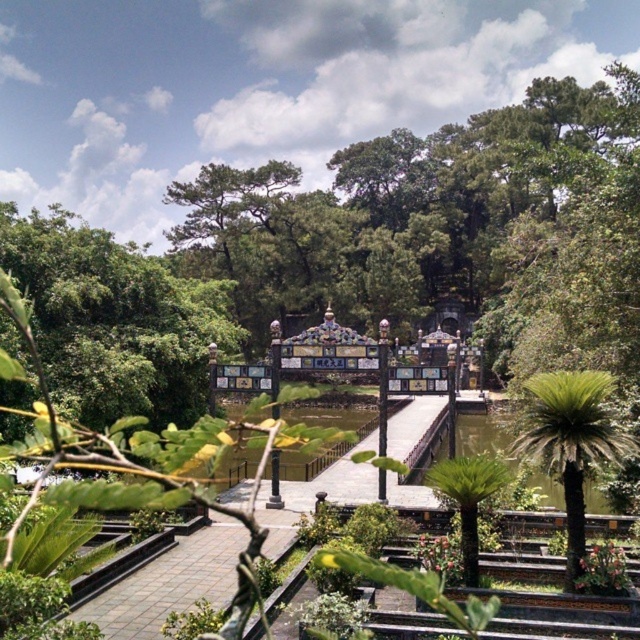
From the picture: Is green leafy tree at center further to camera compared to green leafy palm trees at center?

Yes, it is.

Which is in front, point (72, 384) or point (440, 433)?

Positioned in front is point (72, 384).

Locate an element on the screen. The height and width of the screenshot is (640, 640). green leafy tree at center is located at coordinates (113, 321).

Is green leafy palm at right behind green leafy palm trees at center?

No, it is in front of green leafy palm trees at center.

Who is positioned more to the right, green leafy palm at right or green leafy palm trees at center?

green leafy palm trees at center

Between point (548, 384) and point (490, 426), which one is positioned in front?

Positioned in front is point (548, 384).

Where is `green leafy palm at right`? The width and height of the screenshot is (640, 640). green leafy palm at right is located at coordinates (570, 442).

Between point (122, 396) and point (570, 456), which one is positioned behind?

Positioned behind is point (122, 396).

Does green leafy tree at center appear over green leafy palm at right?

Correct, green leafy tree at center is located above green leafy palm at right.

Does point (129, 403) come closer to viewer compared to point (630, 442)?

No, it is not.

This screenshot has height=640, width=640. Identify the location of green leafy tree at center. (113, 321).